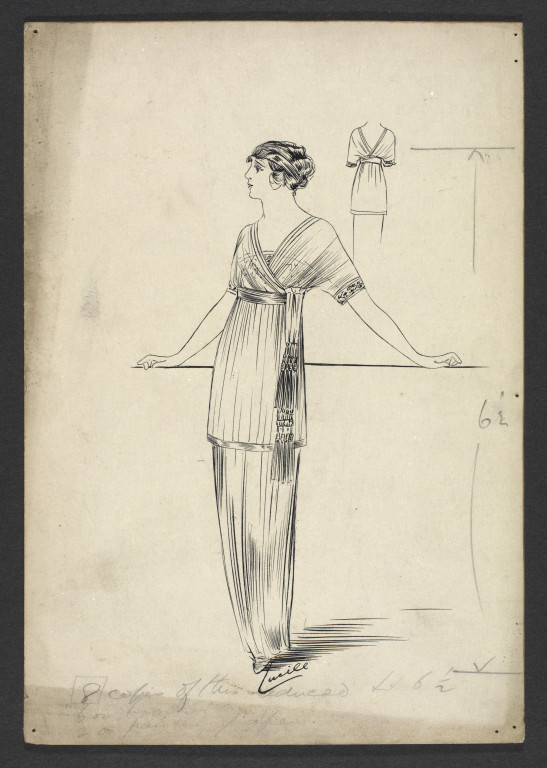
Image resolution: width=547 pixels, height=768 pixels. Identify the location of tassle. (289, 362).